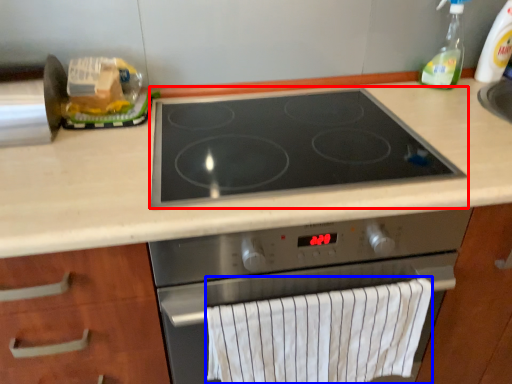
Question: Which of the following is the farthest to the observer, gas stove (highlighted by a red box) or bath towel (highlighted by a blue box)?

Choices:
 (A) gas stove
 (B) bath towel

Answer: (B)